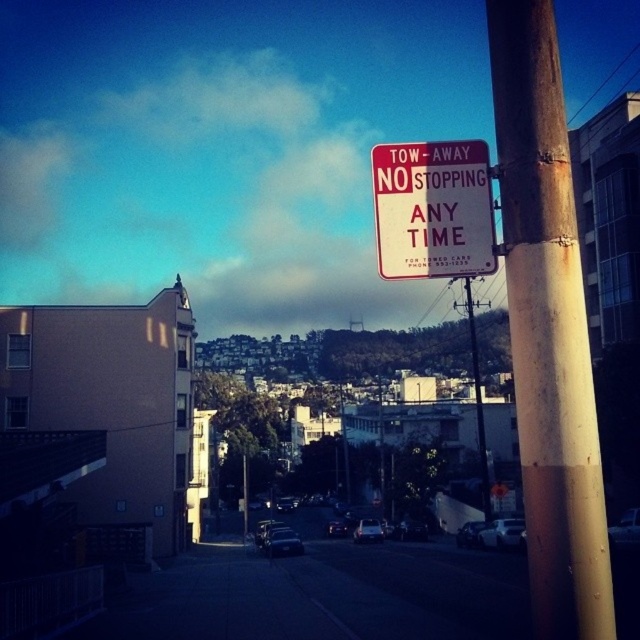
How far apart are rusty metal pole at right and red plastic sign at upper right?

4.80 meters

Is rusty metal pole at right closer to the viewer compared to red plastic sign at upper right?

Yes, it is in front of red plastic sign at upper right.

What do you see at coordinates (548, 330) in the screenshot?
I see `rusty metal pole at right` at bounding box center [548, 330].

The width and height of the screenshot is (640, 640). Identify the location of rusty metal pole at right. (548, 330).